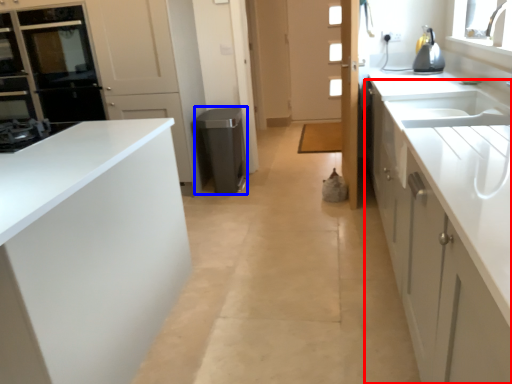
Question: Among these objects, which one is farthest to the camera, cabinetry (highlighted by a red box) or appliance (highlighted by a blue box)?

Choices:
 (A) cabinetry
 (B) appliance

Answer: (B)